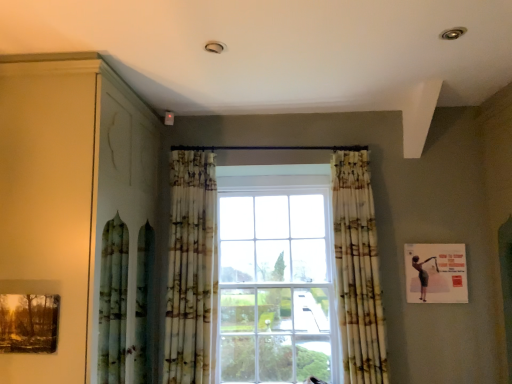
Question: Does matte wooden picture frame at lower left, the second picture frame positioned from the right, have a larger size compared to printed fabric curtain at center, the second curtain when ordered from left to right?

Choices:
 (A) no
 (B) yes

Answer: (A)

Question: Does matte wooden picture frame at lower left, the 1th picture frame viewed from the left, appear on the right side of printed fabric curtain at center, the second curtain when ordered from left to right?

Choices:
 (A) yes
 (B) no

Answer: (B)

Question: Is matte wooden picture frame at lower left, the 1th picture frame viewed from the left, at the left side of printed fabric curtain at center, the second curtain when ordered from left to right?

Choices:
 (A) no
 (B) yes

Answer: (B)

Question: From a real-world perspective, is matte wooden picture frame at lower left, the second picture frame positioned from the right, located beneath printed fabric curtain at center, acting as the 1th curtain starting from the right?

Choices:
 (A) no
 (B) yes

Answer: (B)

Question: Does matte wooden picture frame at lower left, the 1th picture frame viewed from the left, contain printed fabric curtain at center, acting as the 1th curtain starting from the right?

Choices:
 (A) no
 (B) yes

Answer: (A)

Question: From the image's perspective, relative to matte wooden picture frame at lower left, the second picture frame positioned from the right, is printed fabric curtain at center, the second curtain when ordered from left to right, above or below?

Choices:
 (A) below
 (B) above

Answer: (B)

Question: Is printed fabric curtain at center, the second curtain when ordered from left to right, wider or thinner than matte wooden picture frame at lower left, which is the 1th picture frame from front to back?

Choices:
 (A) thin
 (B) wide

Answer: (B)

Question: Is point (343, 162) positioned closer to the camera than point (54, 306)?

Choices:
 (A) farther
 (B) closer

Answer: (A)

Question: Based on their positions, is printed fabric curtain at center, the second curtain when ordered from left to right, located to the left or right of matte wooden picture frame at lower left, which is the 1th picture frame from front to back?

Choices:
 (A) right
 (B) left

Answer: (A)

Question: In the image, is printed fabric curtain at center, the second curtain when ordered from left to right, positioned in front of or behind printed fabric curtain at center, the second curtain in the right-to-left sequence?

Choices:
 (A) behind
 (B) front

Answer: (B)

Question: Considering the positions of printed fabric curtain at center, acting as the 1th curtain starting from the right, and printed fabric curtain at center, the second curtain in the right-to-left sequence, in the image, is printed fabric curtain at center, acting as the 1th curtain starting from the right, bigger or smaller than printed fabric curtain at center, the second curtain in the right-to-left sequence,?

Choices:
 (A) big
 (B) small

Answer: (B)

Question: From the image's perspective, is printed fabric curtain at center, acting as the 1th curtain starting from the right, above or below printed fabric curtain at center, the second curtain in the right-to-left sequence?

Choices:
 (A) above
 (B) below

Answer: (B)

Question: Is point (367, 226) positioned closer to the camera than point (201, 296)?

Choices:
 (A) closer
 (B) farther

Answer: (A)

Question: In terms of size, does matte wood dresser at left appear bigger or smaller than printed fabric curtain at center, which is the 1th curtain from left to right?

Choices:
 (A) small
 (B) big

Answer: (B)

Question: In the image, is matte wood dresser at left on the left side or the right side of printed fabric curtain at center, the second curtain in the right-to-left sequence?

Choices:
 (A) right
 (B) left

Answer: (B)